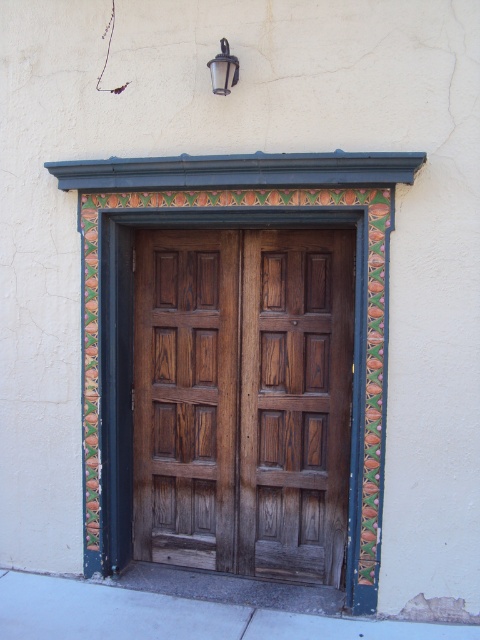
Can you confirm if wooden panelled door at center is positioned to the right of matte glass lamp at upper center?

Indeed, wooden panelled door at center is positioned on the right side of matte glass lamp at upper center.

Is point (140, 518) behind point (223, 65)?

Yes.

Identify the location of wooden panelled door at center. Image resolution: width=480 pixels, height=640 pixels. (242, 400).